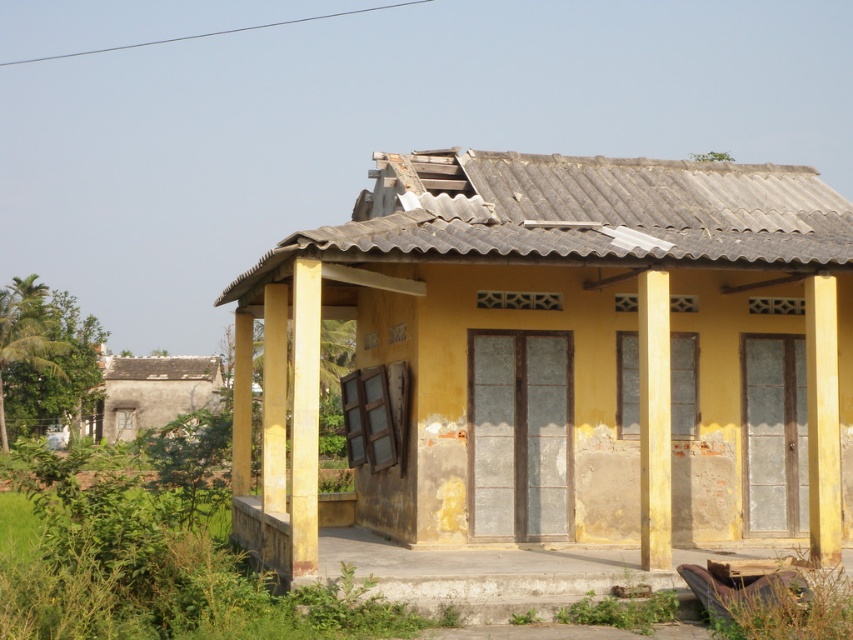
You are standing in front of the yellow matte house at center and want to walk to the yellow painted wood porch at center. Which direction should you move relative to the house?

Since the yellow matte house at center is closer to the viewer than the yellow painted wood porch at center, you should move backward away from the house to reach the porch.